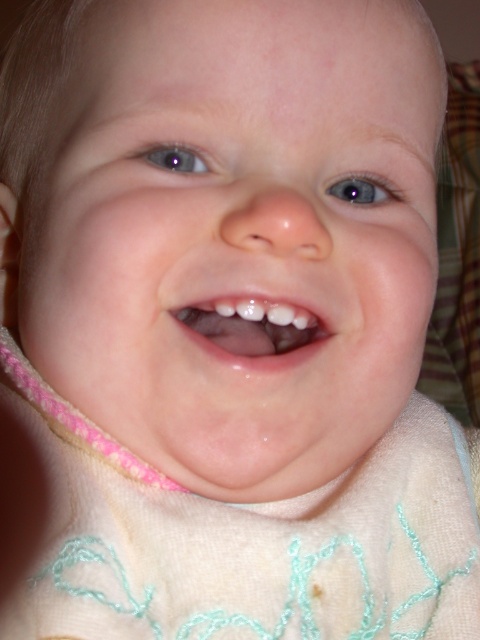
Is smooth skin baby at center to the right of white soft bib at center from the viewer's perspective?

Incorrect, smooth skin baby at center is not on the right side of white soft bib at center.

Which is in front, point (186, 120) or point (430, 440)?

Point (186, 120)

Does point (425, 189) come behind point (267, 588)?

Yes, point (425, 189) is behind point (267, 588).

Find the location of a particular element. smooth skin baby at center is located at coordinates (238, 234).

This screenshot has height=640, width=480. What do you see at coordinates (238, 234) in the screenshot? I see `smooth skin baby at center` at bounding box center [238, 234].

Image resolution: width=480 pixels, height=640 pixels. Identify the location of smooth skin baby at center. (238, 234).

Is point (249, 580) positioned after point (228, 298)?

Yes, point (249, 580) is farther from viewer.

Does point (106, 518) come in front of point (309, 339)?

Yes, point (106, 518) is in front of point (309, 339).

This screenshot has width=480, height=640. Identify the location of white soft bib at center. (228, 536).